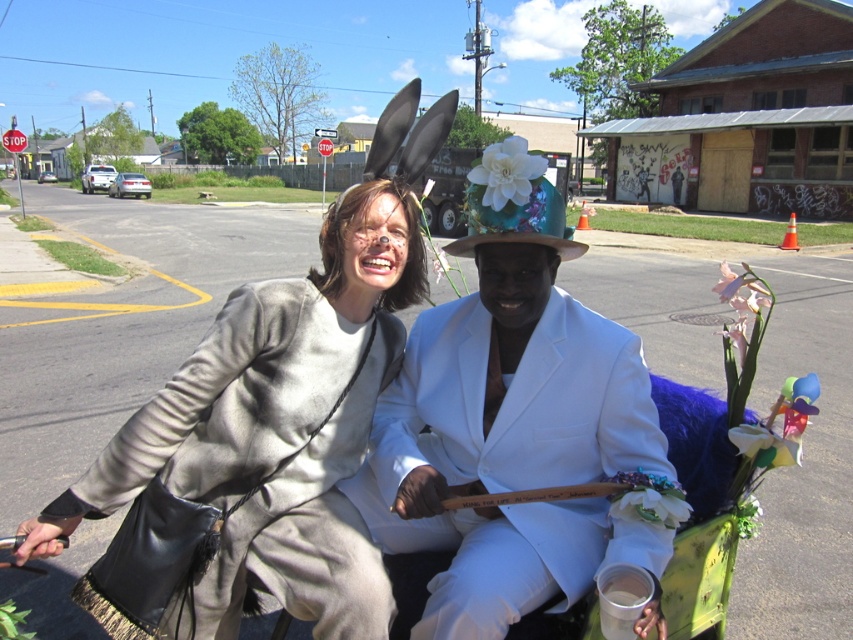
You are a photographer at a parade event and need to capture a photo of both the white satin suit at center and the matte gray coat at center. Based on their positions, which one should you focus on first to ensure both are in frame?

The white satin suit at center is positioned on the right side of matte gray coat at center, so you should focus on the matte gray coat at center first to ensure both are in frame.

You are a photographer trying to capture a photo of the matte gray coat at center and the floral fabric hat at center. You want to ensure both are fully visible in the frame. Given that your camera has a fixed width, which object should you position closer to the edge of the frame to avoid cropping?

The matte gray coat at center is wider than the floral fabric hat at center. To avoid cropping, position the matte gray coat at center closer to the edge of the frame since it is wider and requires more space.

You are standing in front of the cart and want to locate the white satin suit at center. What are the coordinates where you should look?

The white satin suit at center is located at coordinates point (511, 420).